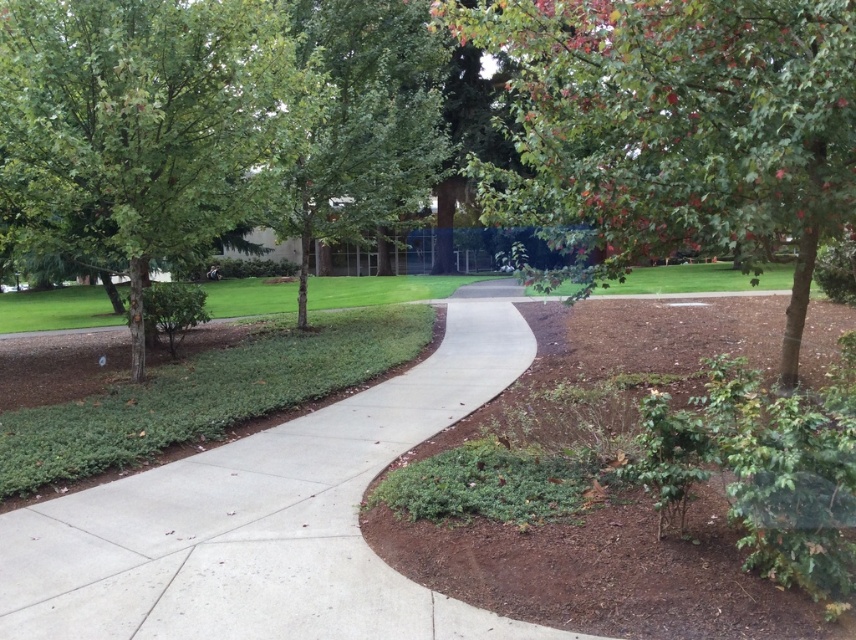
You are standing at the point marked as point (676,124) in the image. Looking around, you see a green leafy tree at upper right. Can you confirm if you are currently standing on the green leafy tree at upper right?

Yes, the point (676,124) is on the green leafy tree at upper right, so you are standing on it.

You are a gardener planning to trim the green leafy tree at upper right and the concrete at center. Which object requires less trimming because it is shorter?

The green leafy tree at upper right requires less trimming because it is shorter than the concrete at center.

You are a gardener planning to water both the green leafy tree at upper right and the green leafy tree at center. If you start from the leftmost point of the pathway, which tree should you approach first?

The green leafy tree at center should be approached first because it is positioned to the left of the green leafy tree at upper right.